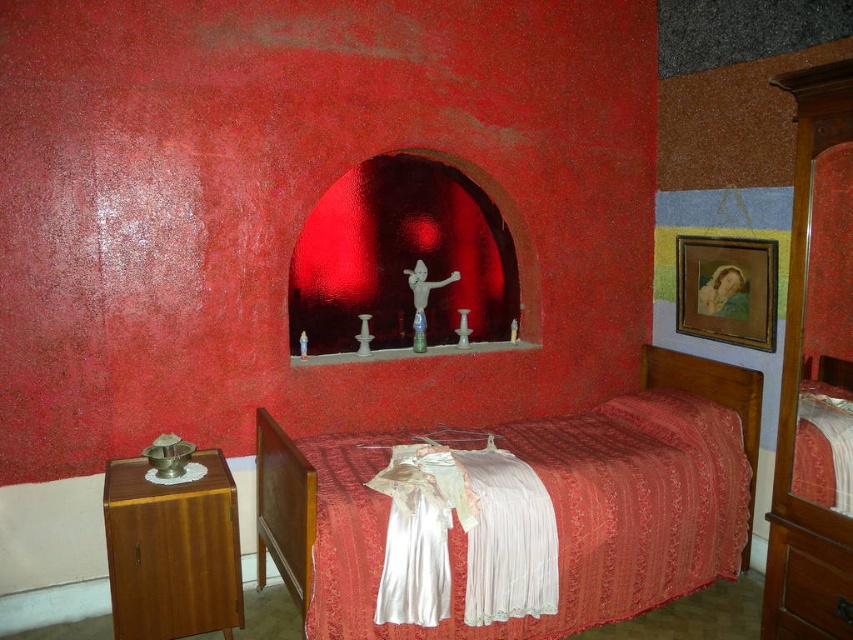
You are organizing a room and need to place a new decorative item between the silky red bed at center and the wooden drawer at lower right. Based on their positions, which object should the item be closer to?

The silky red bed at center is positioned on the left side of wooden drawer at lower right, so the new decorative item should be placed closer to the silky red bed at center to maintain symmetry between the two objects.

You are organizing your bedroom and need to place a large box that is 1.2 meters tall. You have two storage options available in the room. Which object from the wooden dresser at left and wooden drawer at lower right would be more suitable for storing the box based on their vertical space?

The wooden dresser at left is above the wooden drawer at lower right, so the wooden dresser at left has more vertical space and is more suitable for storing the large box that is 1.2 meters tall.